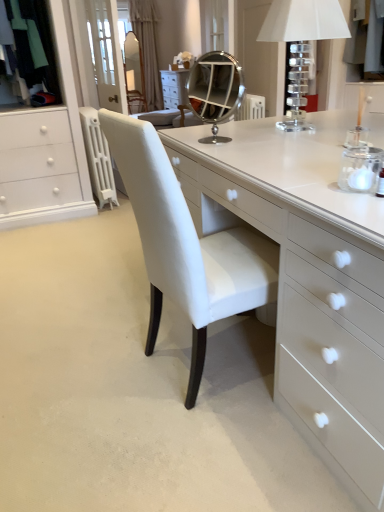
Question: Does gray fabric coat at upper right appear on the right side of matte glass mirror at upper center, the 2th mirror from the right?

Choices:
 (A) yes
 (B) no

Answer: (A)

Question: From the image's perspective, would you say gray fabric coat at upper right is positioned over matte glass mirror at upper center, positioned as the 2th mirror in bottom-to-top order?

Choices:
 (A) no
 (B) yes

Answer: (A)

Question: From a real-world perspective, is gray fabric coat at upper right physically below matte glass mirror at upper center, the 2th mirror when ordered from front to back?

Choices:
 (A) no
 (B) yes

Answer: (A)

Question: Is gray fabric coat at upper right next to matte glass mirror at upper center, the 2th mirror from the right?

Choices:
 (A) no
 (B) yes

Answer: (A)

Question: From a real-world perspective, is gray fabric coat at upper right over matte glass mirror at upper center, which ranks as the 1th mirror in left-to-right order?

Choices:
 (A) yes
 (B) no

Answer: (A)

Question: From the image's perspective, is white textured curtain at upper center above or below gray fabric coat at upper right?

Choices:
 (A) below
 (B) above

Answer: (B)

Question: Is white textured curtain at upper center in front of or behind gray fabric coat at upper right in the image?

Choices:
 (A) front
 (B) behind

Answer: (B)

Question: From a real-world perspective, relative to gray fabric coat at upper right, is white textured curtain at upper center vertically above or below?

Choices:
 (A) above
 (B) below

Answer: (B)

Question: Considering the positions of white textured curtain at upper center and gray fabric coat at upper right in the image, is white textured curtain at upper center wider or thinner than gray fabric coat at upper right?

Choices:
 (A) thin
 (B) wide

Answer: (A)

Question: From a real-world perspective, is clear acrylic table lamp at upper right positioned above or below white textured curtain at upper center?

Choices:
 (A) above
 (B) below

Answer: (B)

Question: From the image's perspective, is clear acrylic table lamp at upper right above or below white textured curtain at upper center?

Choices:
 (A) above
 (B) below

Answer: (B)

Question: Is point 271,30 positioned closer to the camera than point 150,30?

Choices:
 (A) closer
 (B) farther

Answer: (A)

Question: Is clear acrylic table lamp at upper right spatially inside white textured curtain at upper center, or outside of it?

Choices:
 (A) outside
 (B) inside

Answer: (A)

Question: Is gray fabric coat at upper right inside the boundaries of matte glass mirror at upper center, positioned as the 2th mirror in bottom-to-top order, or outside?

Choices:
 (A) outside
 (B) inside

Answer: (A)

Question: Is gray fabric coat at upper right bigger or smaller than matte glass mirror at upper center, the first mirror viewed from the back?

Choices:
 (A) small
 (B) big

Answer: (A)